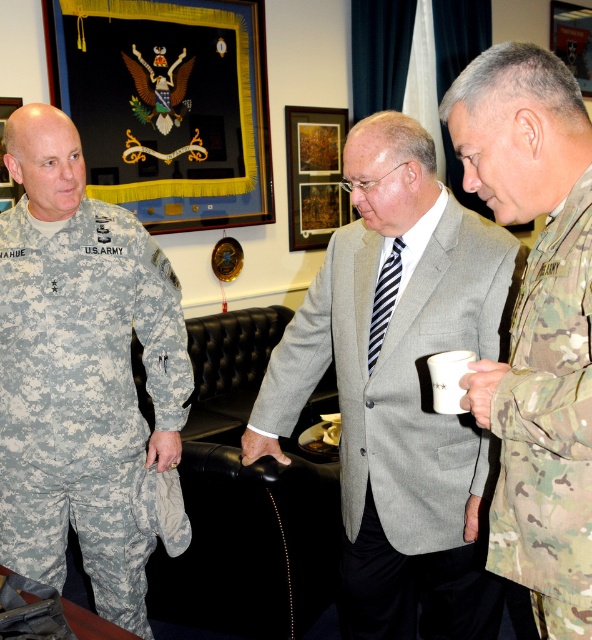
Question: Does gray wool suit at center appear on the left side of camouflage uniform at left?

Choices:
 (A) no
 (B) yes

Answer: (A)

Question: From the image, what is the correct spatial relationship of gray wool suit at center in relation to camouflage uniform at left?

Choices:
 (A) below
 (B) above

Answer: (A)

Question: Is gray wool suit at center closer to camera compared to camouflage uniform at left?

Choices:
 (A) yes
 (B) no

Answer: (A)

Question: Which point is farther to the camera?

Choices:
 (A) camouflage fabric uniform at right
 (B) camouflage uniform at left

Answer: (B)

Question: Which of the following is the closest to the observer?

Choices:
 (A) gray wool suit at center
 (B) camouflage fabric uniform at right

Answer: (B)

Question: Estimate the real-world distances between objects in this image. Which object is farther from the camouflage uniform at left?

Choices:
 (A) camouflage fabric uniform at right
 (B) gray wool suit at center

Answer: (A)